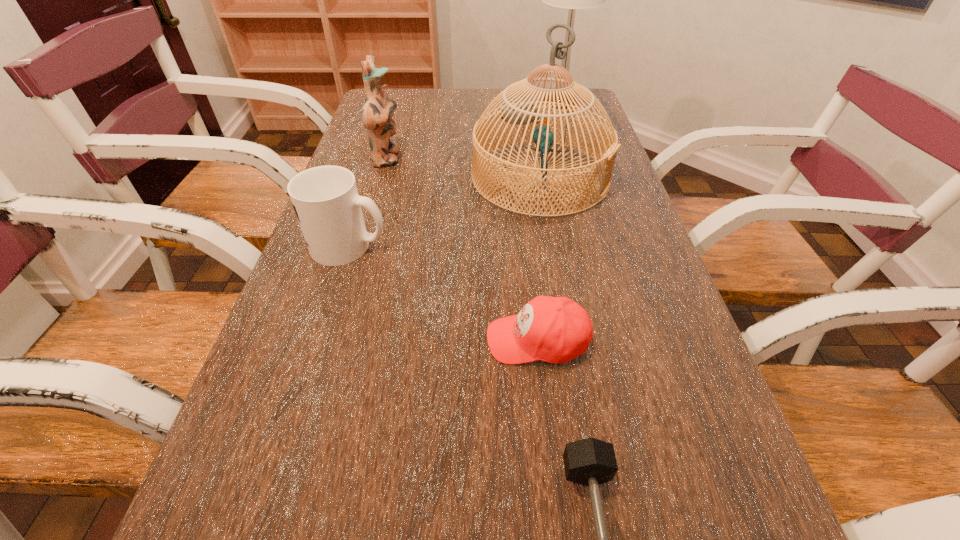
Image resolution: width=960 pixels, height=540 pixels. Identify the location of vacant space that satisfies the following two spatial constraints: 1. on the front-facing side of the fourth shortest object; 2. on the left side of the birdcage. (381, 177).